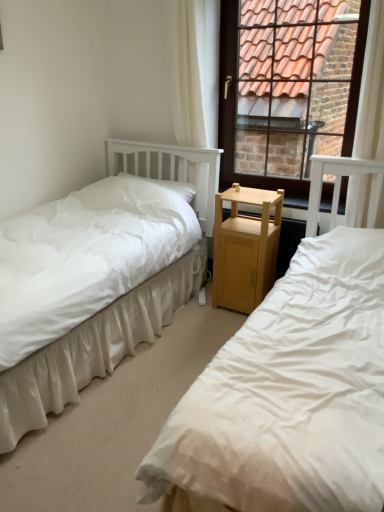
Where is `free space in front of light brown wood nightstand at center`? free space in front of light brown wood nightstand at center is located at coordinates (221, 329).